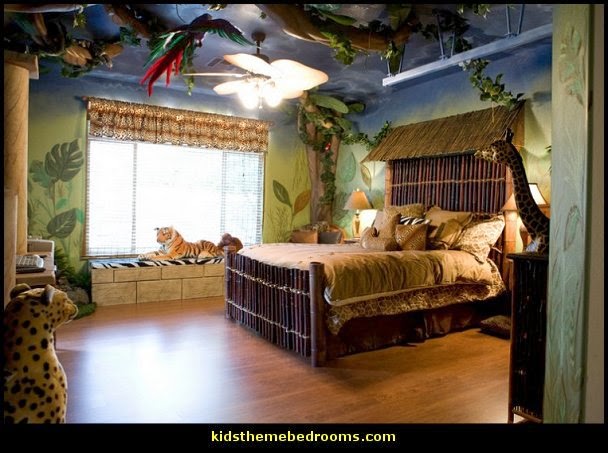
Locate an element on the screen. comforter is located at coordinates (345, 273).